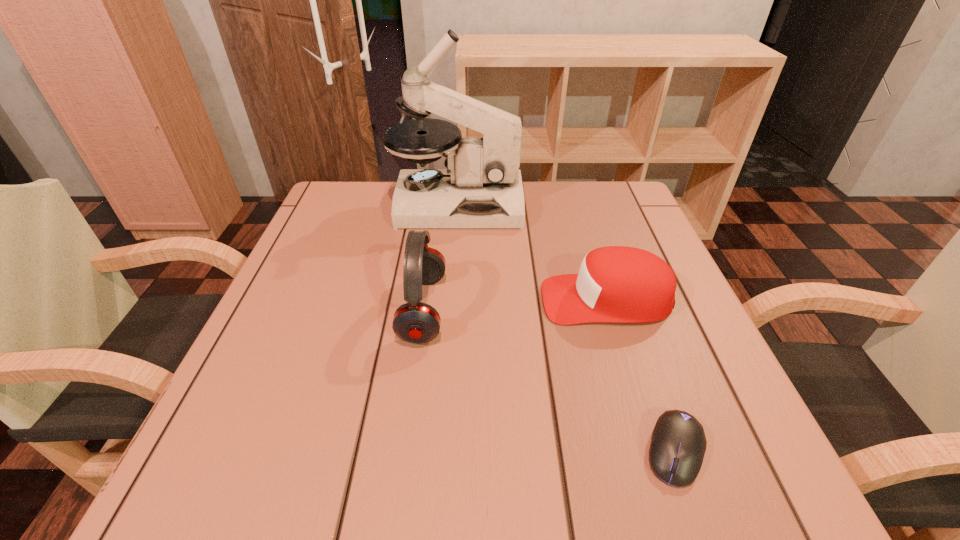
Where is `microscope`? microscope is located at coordinates (482, 187).

The width and height of the screenshot is (960, 540). I want to click on the tallest object, so click(482, 187).

The height and width of the screenshot is (540, 960). I want to click on earphone, so click(415, 322).

Where is `the third tallest object`? the third tallest object is located at coordinates (616, 284).

The height and width of the screenshot is (540, 960). What are the coordinates of `computer mouse` in the screenshot? It's located at 678,445.

Locate an element on the screen. This screenshot has height=540, width=960. the shortest object is located at coordinates (678, 445).

Identify the location of vacant space located at the eyepiece of the microscope. (593, 205).

This screenshot has height=540, width=960. I want to click on vacant area located 0.300m on the ear cups of the second tallest object, so click(605, 309).

The height and width of the screenshot is (540, 960). What are the coordinates of `vacant area situated on the front-facing side of the third tallest object` in the screenshot? It's located at (343, 300).

I want to click on vacant space located 0.060m on the front-facing side of the third tallest object, so click(510, 300).